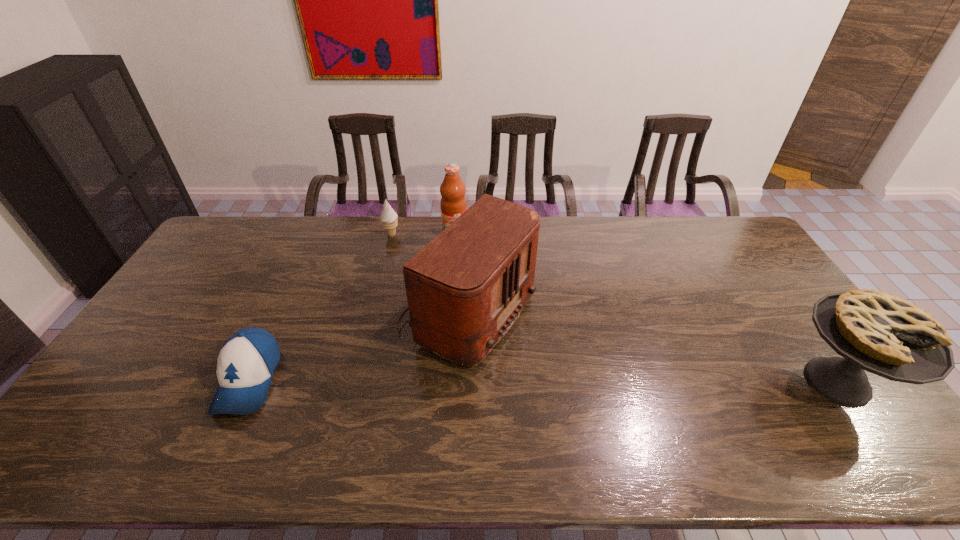
Find the location of a particular element. The width and height of the screenshot is (960, 540). free space that is in between the radio receiver and the rightmost object is located at coordinates (649, 348).

Find the location of `object that is the closest to the pie`. object that is the closest to the pie is located at coordinates (465, 289).

Identify which object is the second closest to the pie. Please provide its 2D coordinates. Your answer should be formatted as a tuple, i.e. [(x, y)], where the tuple contains the x and y coordinates of a point satisfying the conditions above.

[(453, 203)]

At what (x,y) coordinates should I click in order to perform the action: click on blank space that satisfies the following two spatial constraints: 1. on the front side of the radio receiver; 2. on the left side of the second shortest object. Please return your answer as a coordinate pair (x, y). The image size is (960, 540). Looking at the image, I should click on 372,315.